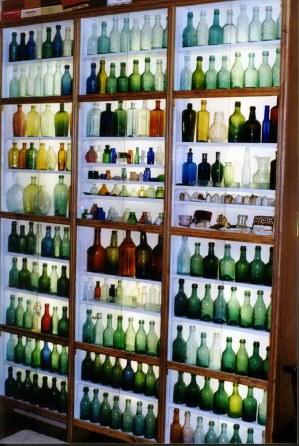
Find the location of `top shelves`. top shelves is located at coordinates (47, 97), (155, 95), (220, 93).